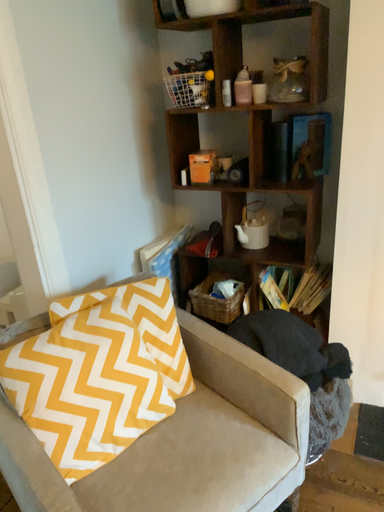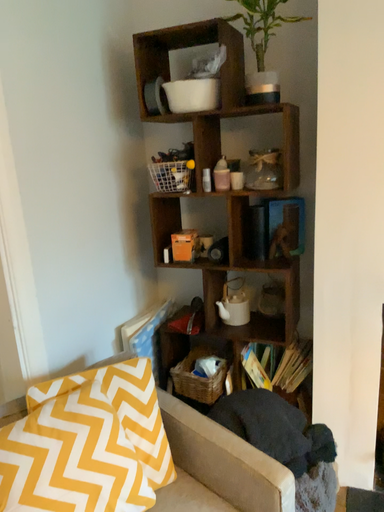
Question: How did the camera likely rotate when shooting the video?

Choices:
 (A) rotated downward
 (B) rotated upward

Answer: (B)